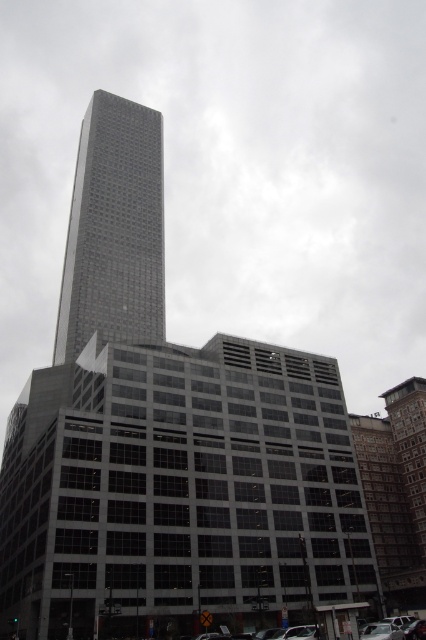
Question: Among these points, which one is farthest from the camera?

Choices:
 (A) (120, 198)
 (B) (396, 634)

Answer: (A)

Question: Is gray glass skyscraper at center to the right of metallic silver car at lower right from the viewer's perspective?

Choices:
 (A) yes
 (B) no

Answer: (B)

Question: Can you confirm if gray glass skyscraper at center is wider than metallic silver car at lower right?

Choices:
 (A) no
 (B) yes

Answer: (B)

Question: Which point is closer to the camera?

Choices:
 (A) (379, 636)
 (B) (149, 136)

Answer: (A)

Question: Which point is closer to the camera taking this photo?

Choices:
 (A) (379, 621)
 (B) (127, 204)

Answer: (A)

Question: Does gray glass skyscraper at center have a larger size compared to metallic silver car at lower right?

Choices:
 (A) yes
 (B) no

Answer: (A)